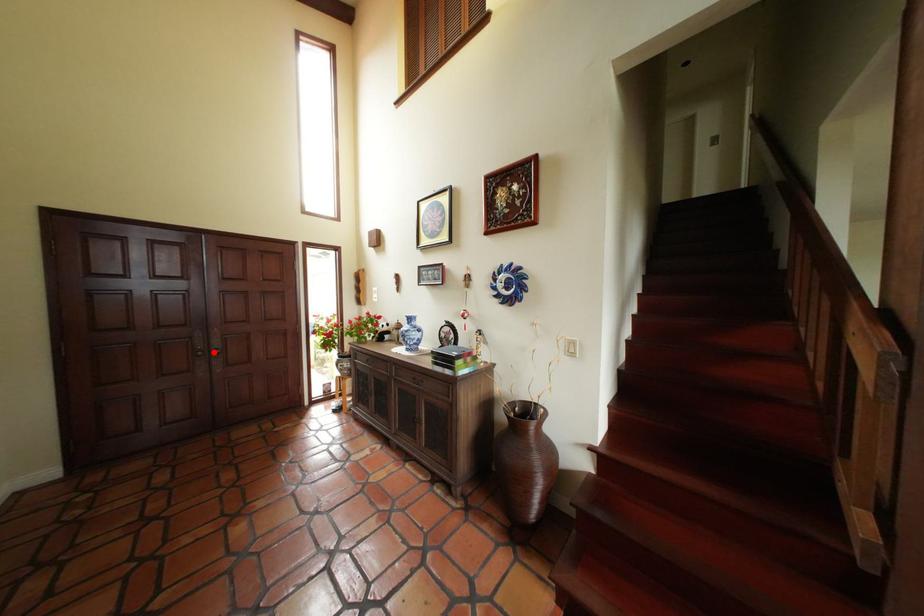
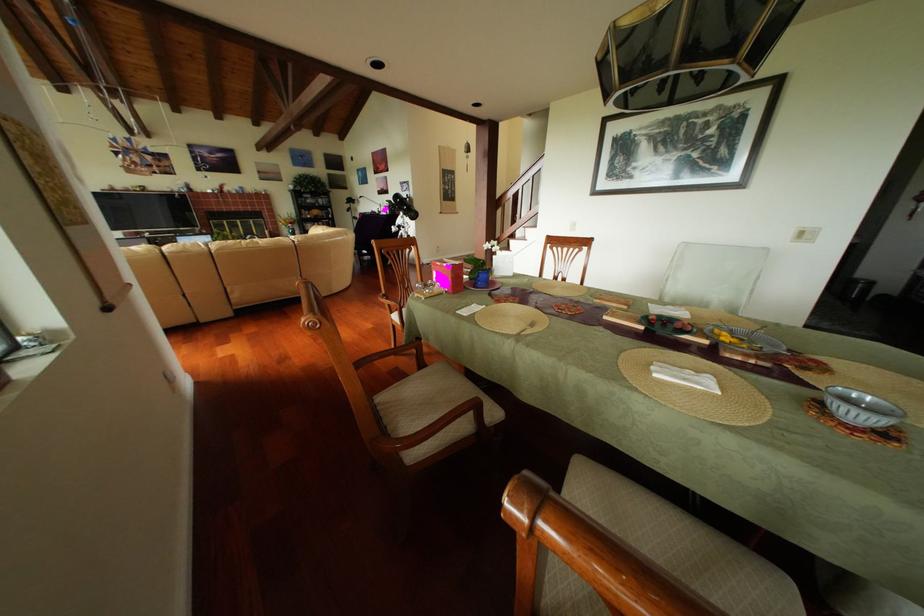
Question: I am providing you with two images of the same scene from different viewpoints. A red point is marked on the first image. Can you still see the location of the red point in image 2?

Choices:
 (A) Yes
 (B) No

Answer: (B)